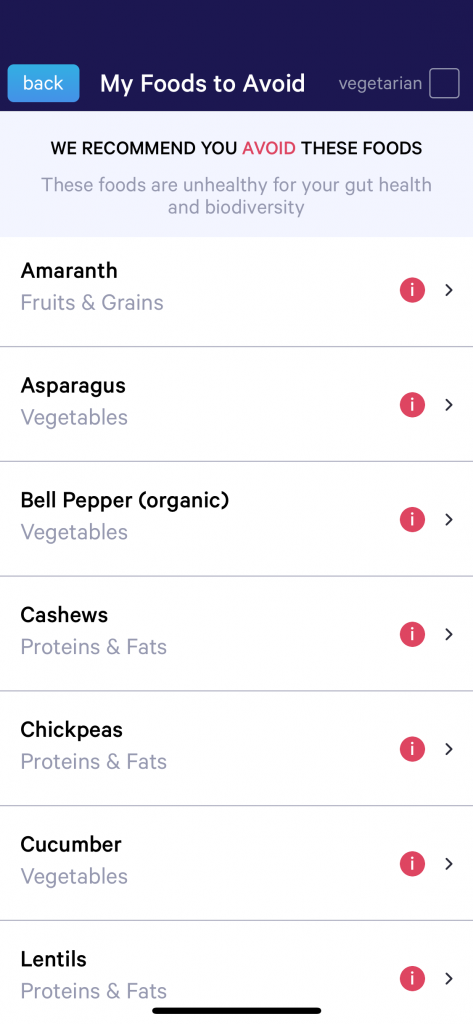
This screenshot has height=1024, width=473. I want to click on box, so click(441, 88).